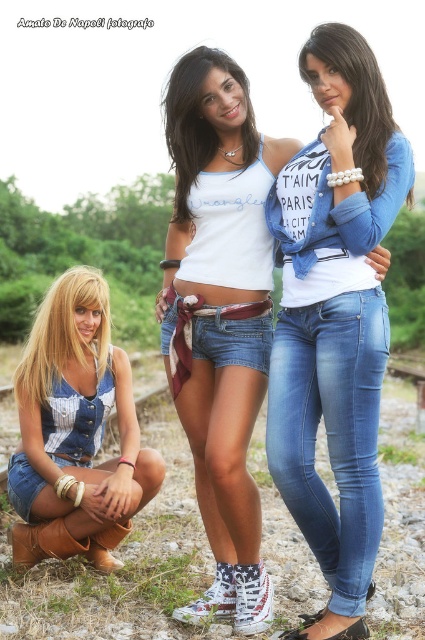
You are standing at the point labeled as point (292, 637) in the image. You want to walk towards the railway track in the background. Is the railway track behind you or in front of you?

The railway track is in front of you because you are at point (292, 637) and the railway track is in the background, which is the direction you are facing when you look towards it from your current position.

You are a photographer trying to capture a group photo of the denim shorts at lower left and the blue denim jeans at center. Based on their positions, which one should you focus on first to ensure both are in frame?

The denim shorts at lower left should be focused on first since it is positioned to the left of the blue denim jeans at center, ensuring both are within the frame when starting from the left side.

You are a photographer trying to capture a group photo of the three people in the image. You need to ensure that all three are in frame. The denim shorts at lower left is located at point (x=76, y=432). Where should you position your camera to include everyone?

To include everyone in the frame, position the camera so that the denim shorts at lower left at point (x=76, y=432) is within the camera view. Adjust the camera angle and zoom to ensure all three individuals are visible.